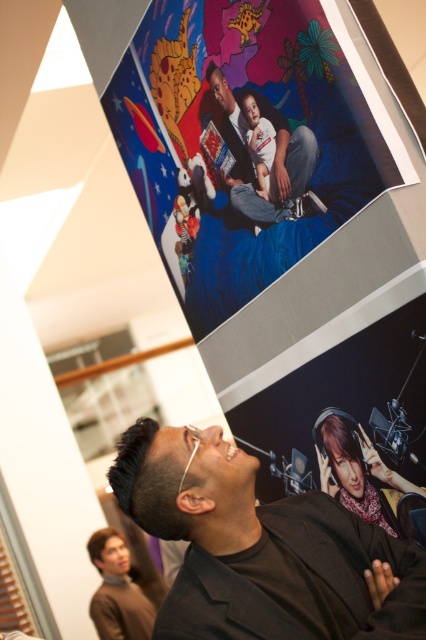
You are an interior designer planning to place a rectangular decorative item that is 1.2 meters wide between the brown leather jacket at lower left and the brown matte hair at upper center. Considering their widths, will the decorative item fit between them?

The brown leather jacket at lower left is wider than the brown matte hair at upper center. Since the decorative item is 1.2 meters wide and the jacket is wider, there might be enough space. However, without knowing the exact distance between them, it is uncertain if the item will fit perfectly.

You are an interior designer assessing the wall space in the art gallery. You need to determine which object, the vibrant paper poster at upper center or the brown matte hair at upper center, has a greater width to ensure proper framing. Based on the scene, which one is wider?

The vibrant paper poster at upper center is wider than the brown matte hair at upper center, as stated in the description that the poster surpasses the hair in width.